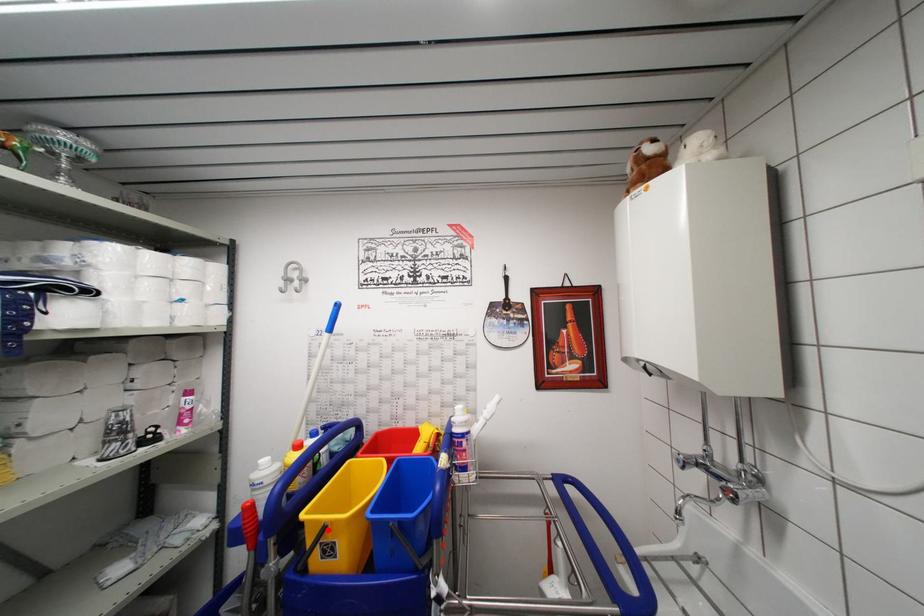
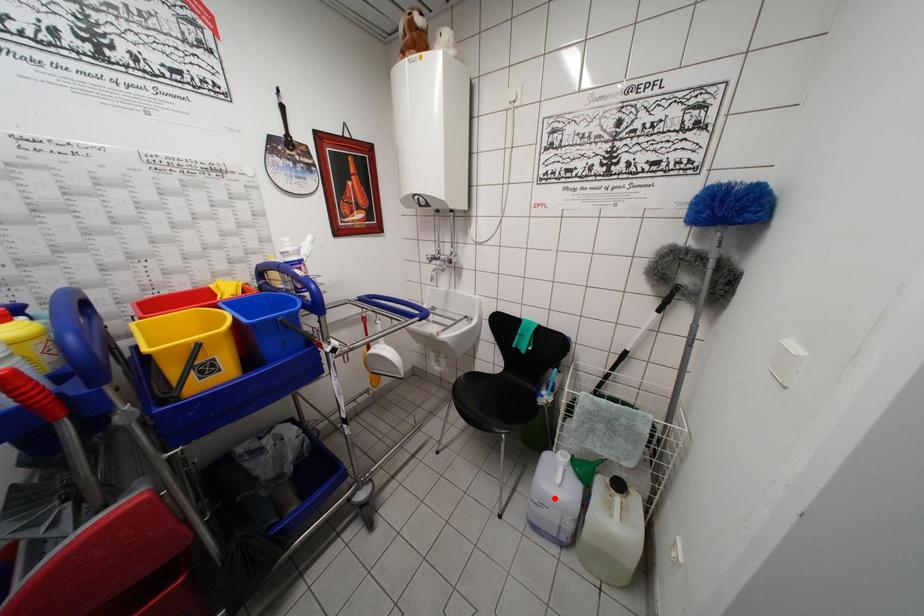
I am providing you with two images of the same scene from different viewpoints. A red point is marked on the first image and another point is marked on the second image. Is the marked point in image1 the same physical position as the marked point in image2?

No